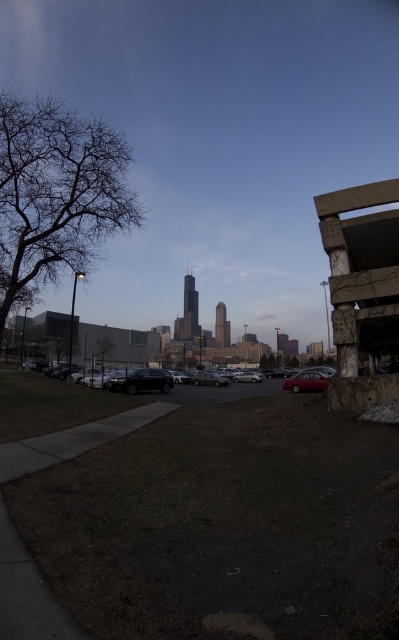
You are standing on the sidewalk and looking towards the parking lot. Which object, the brown dirt at lower center or the bare branches at left, is closer to you?

The brown dirt at lower center is closer to you because it is positioned below the bare branches at left, indicating it is in a lower plane relative to your viewpoint.

You are standing at the point with coordinates point (148, 369) and want to walk towards the point with coordinates point (195, 588). Based on the scene description, which direction should you face to move towards your destination?

You should face forward because point (195, 588) is in front of point (148, 369).